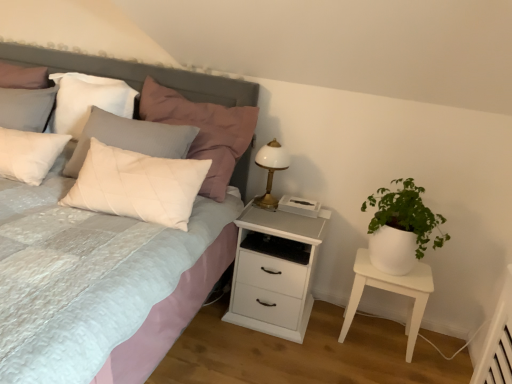
Image resolution: width=512 pixels, height=384 pixels. What are the coordinates of `free point below white matte table at right (from a real-world perspective)` in the screenshot? It's located at (379, 335).